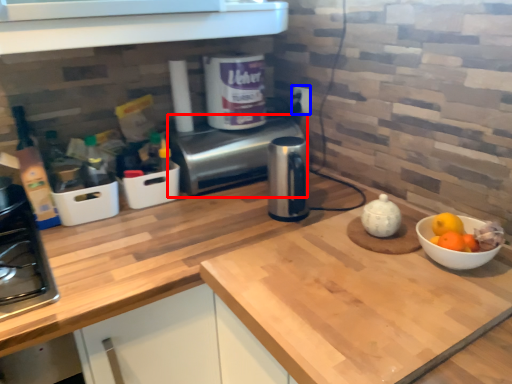
Question: Which object is further to the camera taking this photo, oven (highlighted by a red box) or electric outlet (highlighted by a blue box)?

Choices:
 (A) oven
 (B) electric outlet

Answer: (B)